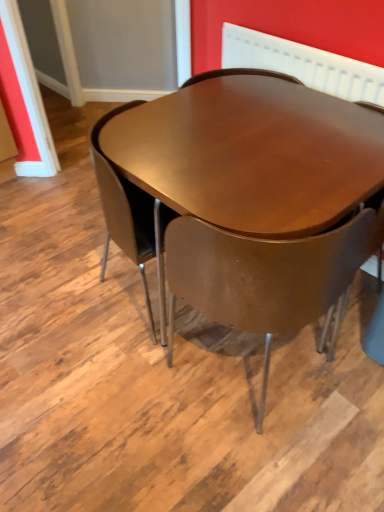
Question: Does shiny brown table at center appear on the right side of white textured radiator at upper center?

Choices:
 (A) yes
 (B) no

Answer: (B)

Question: Is there a large distance between shiny brown table at center and white textured radiator at upper center?

Choices:
 (A) yes
 (B) no

Answer: (B)

Question: Is white textured radiator at upper center a part of shiny brown table at center?

Choices:
 (A) yes
 (B) no

Answer: (B)

Question: From the image's perspective, would you say shiny brown table at center is shown under white textured radiator at upper center?

Choices:
 (A) yes
 (B) no

Answer: (A)

Question: Is shiny brown table at center placed right next to white textured radiator at upper center?

Choices:
 (A) yes
 (B) no

Answer: (B)

Question: Is white textured radiator at upper center inside the boundaries of shiny brown table at center, or outside?

Choices:
 (A) inside
 (B) outside

Answer: (B)

Question: Is point (309, 65) positioned closer to the camera than point (117, 154)?

Choices:
 (A) closer
 (B) farther

Answer: (B)

Question: Considering the relative positions of white textured radiator at upper center and shiny brown table at center in the image provided, is white textured radiator at upper center to the left or to the right of shiny brown table at center?

Choices:
 (A) right
 (B) left

Answer: (A)

Question: From the image's perspective, relative to shiny brown table at center, is white textured radiator at upper center above or below?

Choices:
 (A) below
 (B) above

Answer: (B)

Question: Based on their sizes in the image, would you say shiny brown table at center is bigger or smaller than white textured radiator at upper center?

Choices:
 (A) big
 (B) small

Answer: (A)

Question: Would you say shiny brown table at center is inside or outside white textured radiator at upper center?

Choices:
 (A) outside
 (B) inside

Answer: (A)

Question: From the image's perspective, is shiny brown table at center positioned above or below white textured radiator at upper center?

Choices:
 (A) below
 (B) above

Answer: (A)

Question: Relative to white textured radiator at upper center, is shiny brown table at center in front or behind?

Choices:
 (A) front
 (B) behind

Answer: (A)

Question: Is matte brown chair at center taller or shorter than shiny brown table at center?

Choices:
 (A) tall
 (B) short

Answer: (A)

Question: From the image's perspective, is matte brown chair at center positioned above or below shiny brown table at center?

Choices:
 (A) below
 (B) above

Answer: (A)